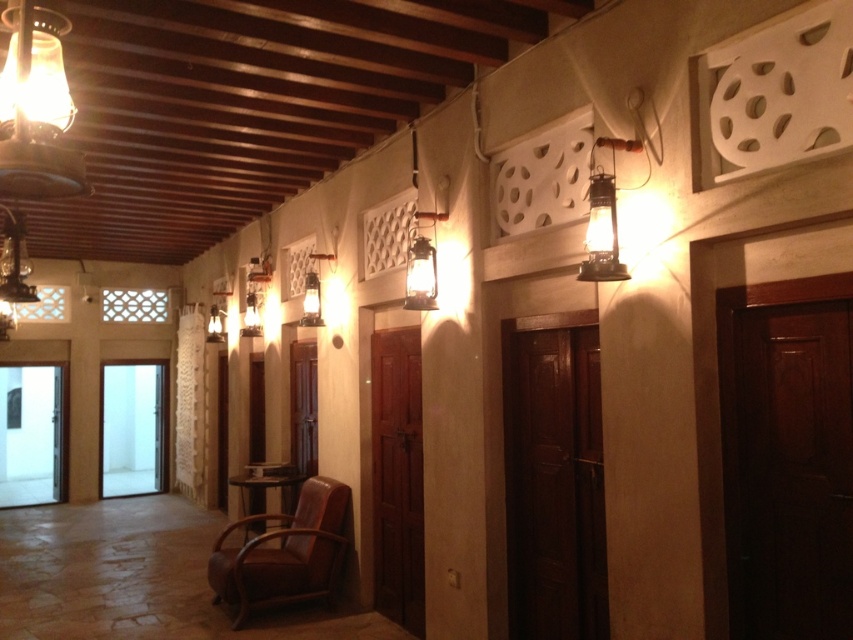
Measure the distance between white glossy door at center and camera.

They are 11.20 meters apart.

Between white glossy door at center and metallic lantern at upper right, which one is positioned lower?

white glossy door at center is lower down.

The width and height of the screenshot is (853, 640). In order to click on white glossy door at center in this screenshot , I will do `click(132, 428)`.

Does brown leather armchair at center come in front of white glossy door at center?

Yes, it is in front of white glossy door at center.

Is brown leather armchair at center shorter than white glossy door at center?

Correct, brown leather armchair at center is not as tall as white glossy door at center.

Between point (323, 586) and point (149, 451), which one is positioned behind?

Point (149, 451)

Where is `brown leather armchair at center`? The image size is (853, 640). brown leather armchair at center is located at coordinates [283, 552].

Can you confirm if matte glass lamp at upper left is shorter than white glossy door at center?

Yes, matte glass lamp at upper left is shorter than white glossy door at center.

Does matte glass lamp at upper left have a lesser width compared to white glossy door at center?

Yes, matte glass lamp at upper left is thinner than white glossy door at center.

I want to click on matte glass lamp at upper left, so click(x=36, y=109).